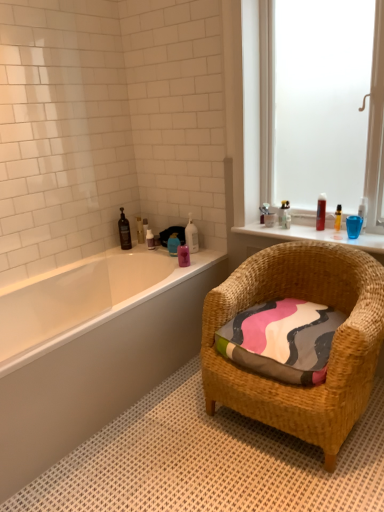
At what (x,y) coordinates should I click in order to perform the action: click on vacant area in front of translucent plastic bottle at upper right, placed as the first toiletry when sorted from right to left. Please return your answer as a coordinate pair (x, y). Looking at the image, I should click on (328, 234).